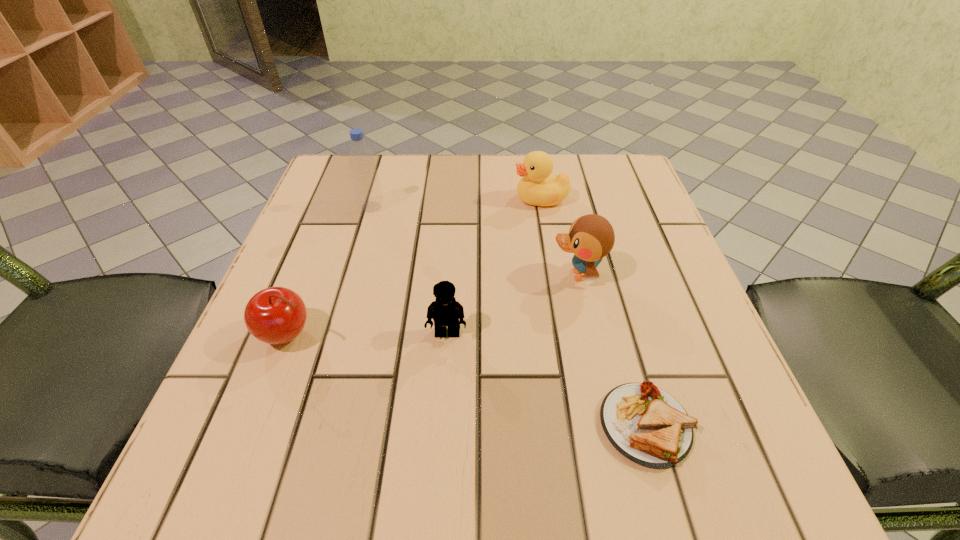
This screenshot has width=960, height=540. What are the coordinates of `vacant area located on the front-facing side of the nearer duck` in the screenshot? It's located at (377, 275).

Locate an element on the screen. This screenshot has width=960, height=540. vacant area located at the beak of the farther duck is located at coordinates (379, 199).

Locate an element on the screen. The image size is (960, 540). vacant space located at the beak of the farther duck is located at coordinates (410, 199).

Find the location of a particular element. free space located at the beak of the farther duck is located at coordinates (339, 199).

Where is `vacant space located 0.260m on the right of the cherry`? vacant space located 0.260m on the right of the cherry is located at coordinates (479, 334).

Where is `vacant area located on the front-facing side of the third object from left to right`? The height and width of the screenshot is (540, 960). vacant area located on the front-facing side of the third object from left to right is located at coordinates pyautogui.click(x=444, y=389).

Where is `vacant area situated on the back of the shortest object`? vacant area situated on the back of the shortest object is located at coordinates (612, 305).

This screenshot has height=540, width=960. What are the coordinates of `bottle that is at the far edge` in the screenshot? It's located at 368,193.

Locate an element on the screen. The height and width of the screenshot is (540, 960). duck at the far edge is located at coordinates (537, 187).

Image resolution: width=960 pixels, height=540 pixels. Find the location of `object that is at the near edge`. object that is at the near edge is located at coordinates (647, 425).